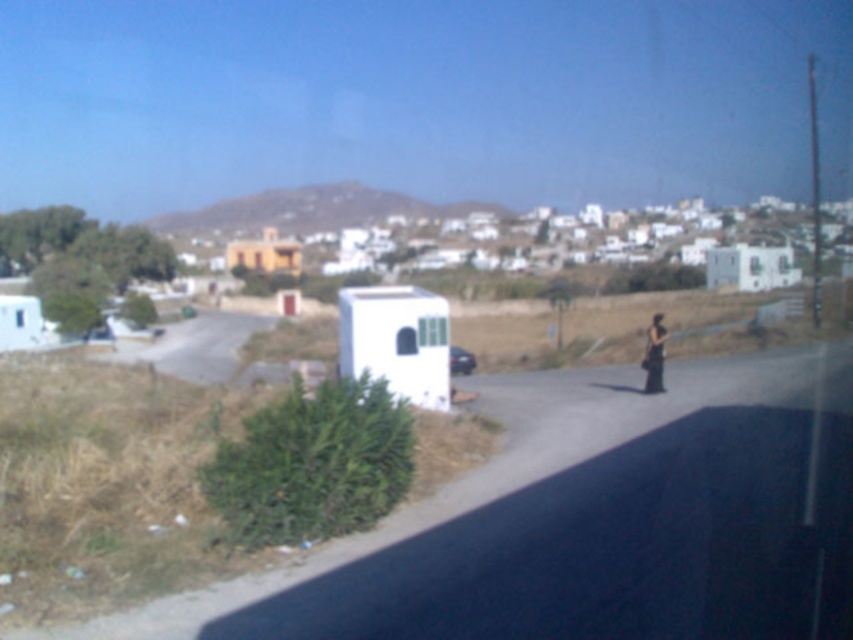
Question: Does black fabric bag at center appear over white matte trailer at center?

Choices:
 (A) no
 (B) yes

Answer: (B)

Question: Can you confirm if black fabric bag at center is positioned below white matte trailer at center?

Choices:
 (A) yes
 (B) no

Answer: (B)

Question: Observing the image, what is the correct spatial positioning of black fabric bag at center in reference to white matte trailer at center?

Choices:
 (A) below
 (B) above

Answer: (B)

Question: Which point appears farthest from the camera in this image?

Choices:
 (A) pos(650,372)
 (B) pos(457,356)

Answer: (B)

Question: Among these points, which one is nearest to the camera?

Choices:
 (A) [457, 369]
 (B) [656, 321]

Answer: (A)

Question: Which point is farther to the camera?

Choices:
 (A) white matte trailer at center
 (B) black fabric bag at center

Answer: (B)